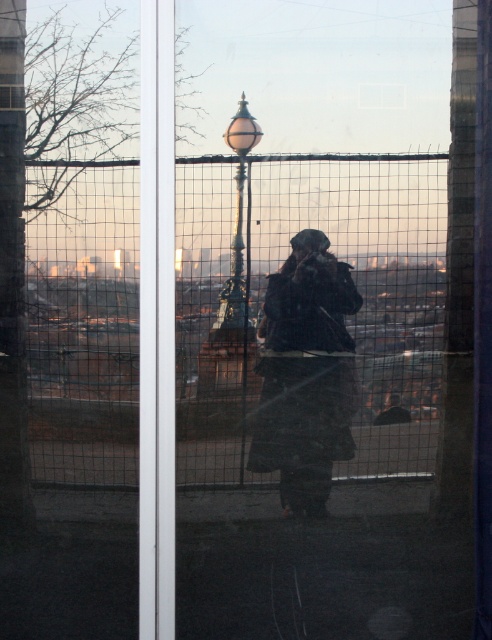
You are a delivery robot trying to pass through the gap between the wire mesh fence at center and the dark gray jacket at center. The robot is 0.5 meters wide. Can you fit through the gap?

The wire mesh fence at center might be wider than dark gray jacket at center, so the gap between them could be more than 0.5 meters. The robot might be able to fit through, but there is uncertainty due to the description using the word might.